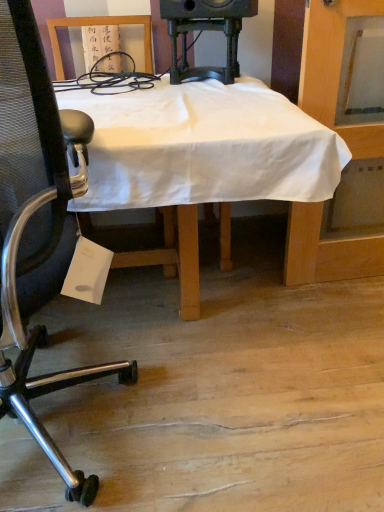
Describe the element at coordinates (201, 158) in the screenshot. I see `white cloth-covered desk at center` at that location.

At what (x,y) coordinates should I click in order to perform the action: click on black plastic speaker at upper center. Please return your answer as a coordinate pair (x, y). This screenshot has width=384, height=512. Looking at the image, I should click on (206, 30).

Image resolution: width=384 pixels, height=512 pixels. I want to click on white cloth-covered desk at center, so click(201, 158).

Is white cloth-covered desk at center smaller than black plastic speaker at upper center?

Actually, white cloth-covered desk at center might be larger than black plastic speaker at upper center.

Considering the relative positions of white cloth-covered desk at center and black plastic speaker at upper center in the image provided, is white cloth-covered desk at center in front of black plastic speaker at upper center?

Yes, white cloth-covered desk at center is closer to the viewer.

Would you say white cloth-covered desk at center contains black plastic speaker at upper center?

Yes, black plastic speaker at upper center can be found within white cloth-covered desk at center.

Is white cloth-covered desk at center aimed at black plastic speaker at upper center?

No.

Considering the relative positions of black plastic speaker at upper center and metallic mesh chair at left in the image provided, is black plastic speaker at upper center to the left of metallic mesh chair at left from the viewer's perspective?

No, black plastic speaker at upper center is not to the left of metallic mesh chair at left.

Between black plastic speaker at upper center and metallic mesh chair at left, which one has smaller size?

With smaller size is black plastic speaker at upper center.

Does point (202, 15) come in front of point (18, 100)?

No, (202, 15) is further to viewer.

From a real-world perspective, relative to metallic mesh chair at left, is black plastic speaker at upper center vertically above or below?

From a real-world perspective, black plastic speaker at upper center is physically above metallic mesh chair at left.

Is metallic mesh chair at left closer to camera compared to white cloth-covered desk at center?

Yes, the depth of metallic mesh chair at left is less than that of white cloth-covered desk at center.

This screenshot has width=384, height=512. In order to click on desk to the right of metallic mesh chair at left in this screenshot , I will do `click(201, 158)`.

From the image's perspective, is metallic mesh chair at left located above or below white cloth-covered desk at center?

Based on their image positions, metallic mesh chair at left is located beneath white cloth-covered desk at center.

Can you confirm if metallic mesh chair at left is positioned to the right of white cloth-covered desk at center?

No, metallic mesh chair at left is not to the right of white cloth-covered desk at center.

Which object is further away from the camera taking this photo, black plastic speaker at upper center or white cloth-covered desk at center?

black plastic speaker at upper center is further from the camera.

The image size is (384, 512). What are the coordinates of `speaker above the white cloth-covered desk at center (from a real-world perspective)` in the screenshot? It's located at (206, 30).

Is point (219, 22) positioned in front of point (314, 139)?

No, (219, 22) is behind (314, 139).

Is black plastic speaker at upper center next to white cloth-covered desk at center and touching it?

No, black plastic speaker at upper center is not in contact with white cloth-covered desk at center.

Consider the image. Is metallic mesh chair at left completely or partially outside of black plastic speaker at upper center?

metallic mesh chair at left lies outside black plastic speaker at upper center's area.

Based on the photo, how distant is metallic mesh chair at left from black plastic speaker at upper center?

metallic mesh chair at left is 3.39 feet away from black plastic speaker at upper center.

From the image's perspective, relative to black plastic speaker at upper center, is metallic mesh chair at left above or below?

Clearly, from the image's perspective, metallic mesh chair at left is below black plastic speaker at upper center.

Does metallic mesh chair at left appear on the right side of black plastic speaker at upper center?

In fact, metallic mesh chair at left is to the left of black plastic speaker at upper center.

From the image's perspective, who appears lower, white cloth-covered desk at center or metallic mesh chair at left?

metallic mesh chair at left appears lower in the image.

Does white cloth-covered desk at center touch metallic mesh chair at left?

No, white cloth-covered desk at center is not next to metallic mesh chair at left.

Would you say white cloth-covered desk at center is to the left or to the right of metallic mesh chair at left in the picture?

white cloth-covered desk at center is positioned on metallic mesh chair at left's right side.

Is white cloth-covered desk at center completely or partially outside of metallic mesh chair at left?

Yes, white cloth-covered desk at center is outside of metallic mesh chair at left.

Find the location of a particular element. speaker on the right side of white cloth-covered desk at center is located at coordinates (206, 30).

The height and width of the screenshot is (512, 384). I want to click on chair below the black plastic speaker at upper center (from a real-world perspective), so click(x=37, y=220).

Looking at this image, which object lies nearer to the anchor point white cloth-covered desk at center, black plastic speaker at upper center or metallic mesh chair at left?

metallic mesh chair at left is closer to white cloth-covered desk at center.

Based on the photo, which object lies nearer to the anchor point black plastic speaker at upper center, white cloth-covered desk at center or metallic mesh chair at left?

white cloth-covered desk at center is positioned closer to the anchor black plastic speaker at upper center.

Considering their positions, is white cloth-covered desk at center positioned further to metallic mesh chair at left than black plastic speaker at upper center?

The object further to metallic mesh chair at left is black plastic speaker at upper center.

From the image, which object appears to be nearer to white cloth-covered desk at center, metallic mesh chair at left or black plastic speaker at upper center?

metallic mesh chair at left is positioned closer to the anchor white cloth-covered desk at center.

Considering their positions, is black plastic speaker at upper center positioned further to metallic mesh chair at left than white cloth-covered desk at center?

Based on the image, black plastic speaker at upper center appears to be further to metallic mesh chair at left.

Considering their positions, is metallic mesh chair at left positioned closer to black plastic speaker at upper center than white cloth-covered desk at center?

The object closer to black plastic speaker at upper center is white cloth-covered desk at center.

The width and height of the screenshot is (384, 512). I want to click on desk between metallic mesh chair at left and black plastic speaker at upper center in the front-back direction, so click(x=201, y=158).